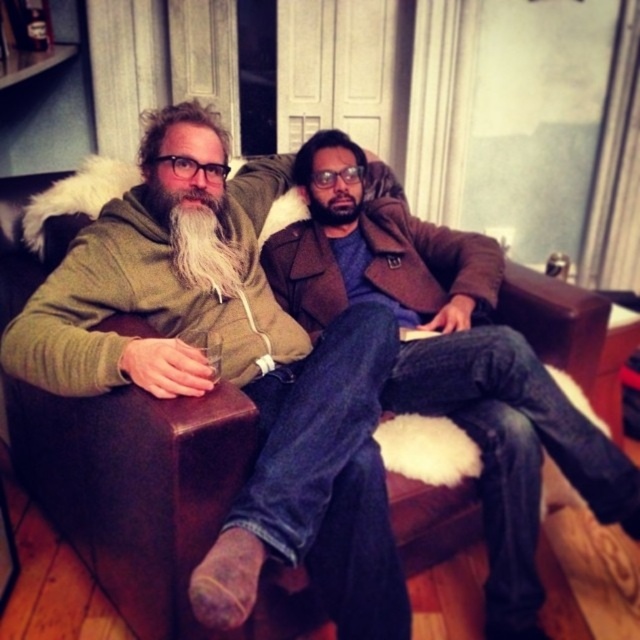
You are standing in the living room and want to reach a point that is 5.56 feet away from you. Can you confirm if the point you are aiming for is the point at coordinates point (10, 241)?

The point (10, 241) is 5.56 feet away from the viewer, so yes, the point you are aiming for is the point at coordinates point (10, 241).

From the picture: You are a guest entering the living room and want to sit next to the person with the white fuzzy beard at left. The brown leather couch at center is your only option. Can you determine which side of the couch you should sit on to be next to them?

The brown leather couch at center is to the left of white fuzzy beard at left, so to sit next to the person with the white fuzzy beard at left, you should sit on the right side of the brown leather couch at center.

You are a guest entering the living room and see the brown leather couch at center and the white fuzzy beard at left. Which object is closer to the floor?

The brown leather couch at center is closer to the floor since it is located below the white fuzzy beard at left.